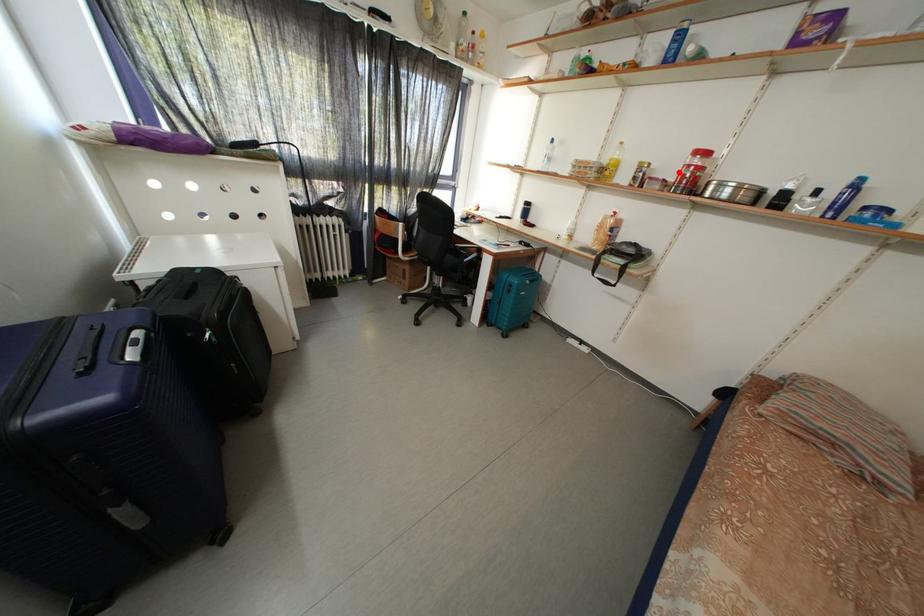
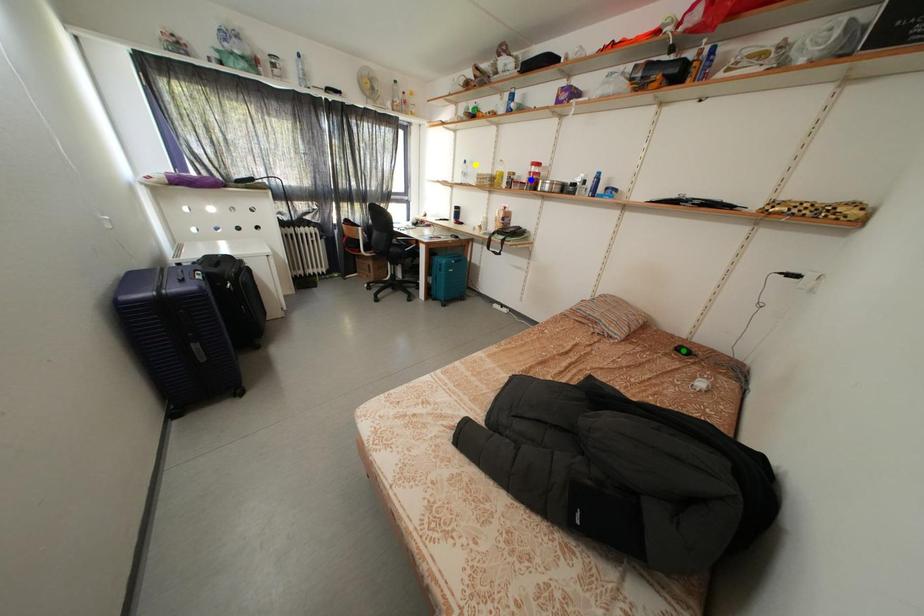
Question: I am providing you with two images of the same scene from different viewpoints. A red point is marked on the first image. You are given multiple points on the second image. Can you choose the point in image 2 that corresponds to the point in image 1?

Choices:
 (A) blue point
 (B) green point
 (C) yellow point

Answer: (A)